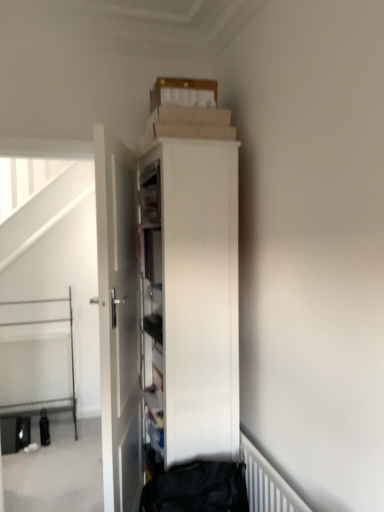
Question: From a real-world perspective, is white glossy cabinet at center above or below white glossy door at center?

Choices:
 (A) above
 (B) below

Answer: (A)

Question: Considering the positions of white glossy cabinet at center and white glossy door at center in the image, is white glossy cabinet at center taller or shorter than white glossy door at center?

Choices:
 (A) tall
 (B) short

Answer: (B)

Question: Estimate the real-world distances between objects in this image. Which object is closer to the white glossy door at center?

Choices:
 (A) white textured radiator at lower left, which appears as the first radiator when viewed from the back
 (B) white glossy cabinet at center
 (C) white metal bed at lower left
 (D) white matte radiator at lower right, the 1th radiator from the front

Answer: (B)

Question: Which is farther from the white textured radiator at lower left, acting as the first radiator starting from the left?

Choices:
 (A) white glossy cabinet at center
 (B) white matte radiator at lower right, which is the 1th radiator from right to left
 (C) white metal bed at lower left
 (D) white glossy door at center

Answer: (B)